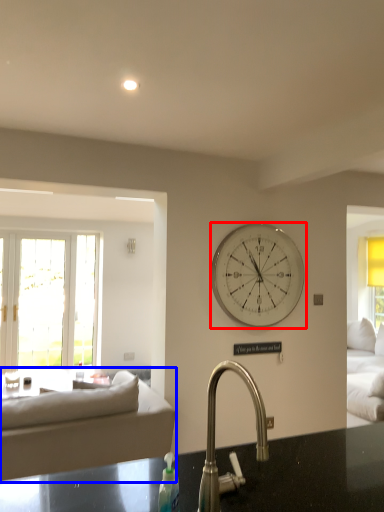
Question: Which object is further to the camera taking this photo, wall clock (highlighted by a red box) or studio couch (highlighted by a blue box)?

Choices:
 (A) wall clock
 (B) studio couch

Answer: (A)